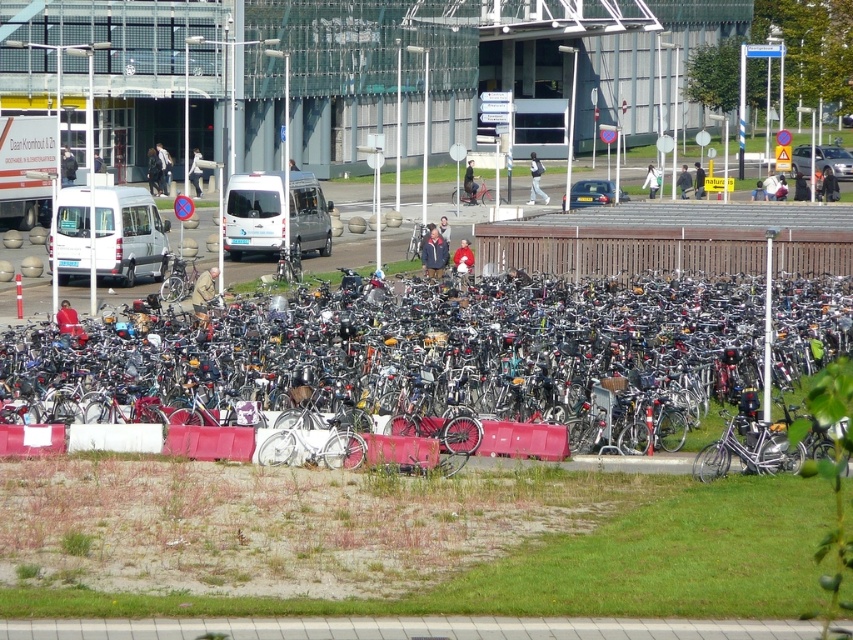
Which is behind, point (389, 394) or point (544, 259)?

The point (544, 259) is behind.

Is point (154, 369) positioned behind point (631, 227)?

No, (154, 369) is closer to viewer.

At what (x,y) coordinates should I click in order to perform the action: click on silver metallic bicycle at center. Please return your answer as a coordinate pair (x, y). Looking at the image, I should click on (415, 358).